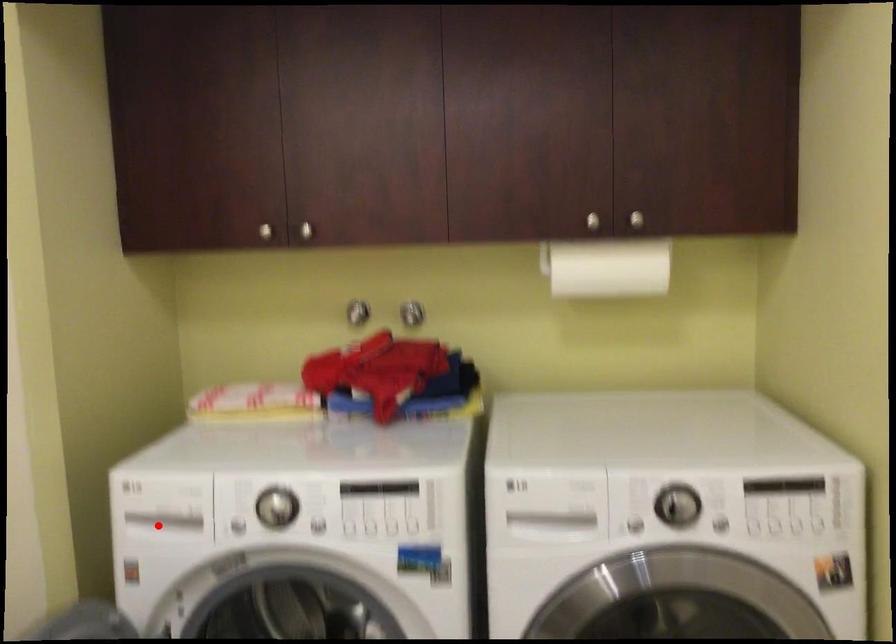
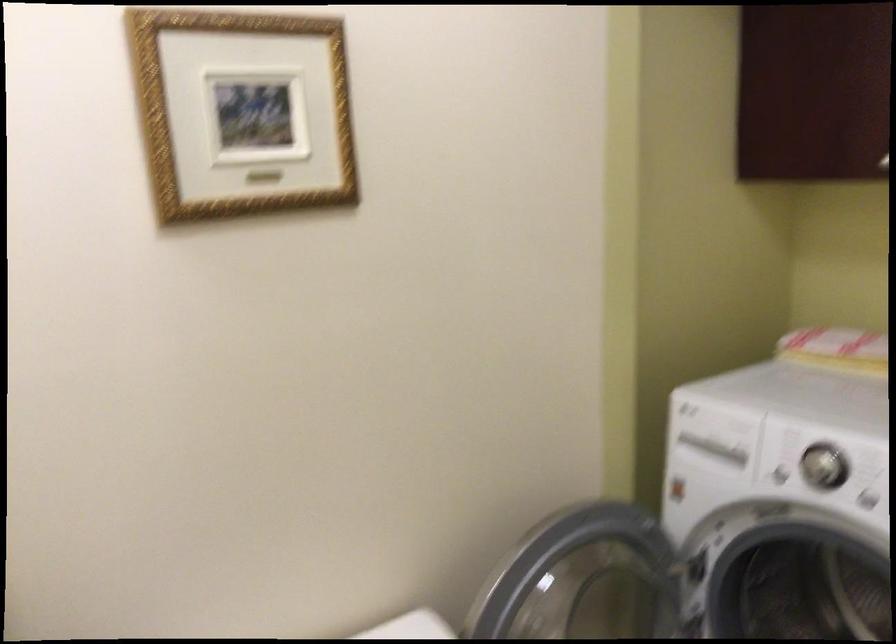
Find the pixel in the second image that matches the highlighted location in the first image.

(708, 451)